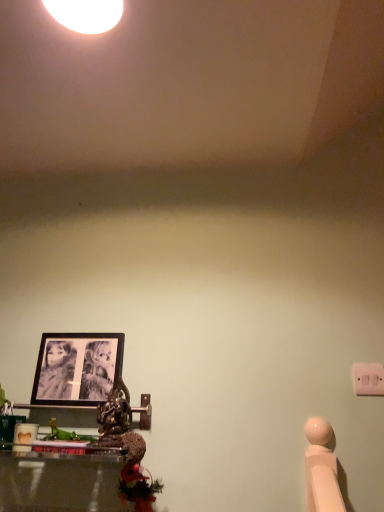
The height and width of the screenshot is (512, 384). Describe the element at coordinates (368, 379) in the screenshot. I see `white plastic light switch at right` at that location.

The image size is (384, 512). Find the location of `white plastic light switch at right`. white plastic light switch at right is located at coordinates (368, 379).

Measure the distance between point (366, 379) and camera.

Point (366, 379) is 1.22 meters away from camera.

Image resolution: width=384 pixels, height=512 pixels. Describe the element at coordinates (77, 368) in the screenshot. I see `black matte picture frame at left` at that location.

Identify the location of black matte picture frame at left. [77, 368].

What are the coordinates of `white plastic light switch at right` in the screenshot? It's located at (368, 379).

Is white plastic light switch at right to the left of black matte picture frame at left from the viewer's perspective?

No, white plastic light switch at right is not to the left of black matte picture frame at left.

Is the position of white plastic light switch at right more distant than that of black matte picture frame at left?

No, it is in front of black matte picture frame at left.

Does point (372, 394) come closer to viewer compared to point (58, 337)?

Yes, point (372, 394) is in front of point (58, 337).

From the image's perspective, between white plastic light switch at right and black matte picture frame at left, which one is located above?

black matte picture frame at left, from the image's perspective.

From a real-world perspective, which is physically above, white plastic light switch at right or black matte picture frame at left?

→ From a 3D spatial view, black matte picture frame at left is above.

Considering the relative sizes of white plastic light switch at right and black matte picture frame at left in the image provided, is white plastic light switch at right wider than black matte picture frame at left?

In fact, white plastic light switch at right might be narrower than black matte picture frame at left.

Considering the sizes of objects white plastic light switch at right and black matte picture frame at left in the image provided, who is taller, white plastic light switch at right or black matte picture frame at left?

With more height is black matte picture frame at left.

In terms of size, does white plastic light switch at right appear bigger or smaller than black matte picture frame at left?

Clearly, white plastic light switch at right is smaller in size than black matte picture frame at left.

Is white plastic light switch at right inside the boundaries of black matte picture frame at left, or outside?

The correct answer is: outside.

Based on the photo, can you see white plastic light switch at right touching black matte picture frame at left?

No, white plastic light switch at right is not next to black matte picture frame at left.

Is white plastic light switch at right positioned with its back to black matte picture frame at left?

white plastic light switch at right does not have its back to black matte picture frame at left.

What's the angular difference between white plastic light switch at right and black matte picture frame at left's facing directions?

1.13 degrees separate the facing orientations of white plastic light switch at right and black matte picture frame at left.

At what (x,y) coordinates should I click in order to perform the action: click on picture frame behind the white plastic light switch at right. Please return your answer as a coordinate pair (x, y). Image resolution: width=384 pixels, height=512 pixels. Looking at the image, I should click on (77, 368).

Between black matte picture frame at left and white plastic light switch at right, which one appears on the left side from the viewer's perspective?

black matte picture frame at left.

In the scene shown: Between black matte picture frame at left and white plastic light switch at right, which one is positioned behind?

black matte picture frame at left is further from the camera.

Is point (40, 368) behind point (352, 368)?

Yes.

From the image's perspective, is black matte picture frame at left below white plastic light switch at right?

No.

From a real-world perspective, who is located higher, black matte picture frame at left or white plastic light switch at right?

In real-world perspective, black matte picture frame at left is above.

Looking at this image, does black matte picture frame at left have a lesser width compared to white plastic light switch at right?

No.

Is black matte picture frame at left taller than white plastic light switch at right?

Indeed, black matte picture frame at left has a greater height compared to white plastic light switch at right.

Between black matte picture frame at left and white plastic light switch at right, which one has smaller size?

white plastic light switch at right is smaller.

Could white plastic light switch at right be considered to be inside black matte picture frame at left?

No, white plastic light switch at right is not surrounded by black matte picture frame at left.

Is black matte picture frame at left placed right next to white plastic light switch at right?

black matte picture frame at left is not next to white plastic light switch at right, and they're not touching.

Does black matte picture frame at left turn towards white plastic light switch at right?

No, black matte picture frame at left is not facing towards white plastic light switch at right.

How many degrees apart are the facing directions of black matte picture frame at left and white plastic light switch at right?

The angle between the facing direction of black matte picture frame at left and the facing direction of white plastic light switch at right is 1.13 degrees.

Image resolution: width=384 pixels, height=512 pixels. What are the coordinates of `light switch below the black matte picture frame at left (from the image's perspective)` in the screenshot? It's located at (368, 379).

You are a GUI agent. You are given a task and a screenshot of the screen. Output one action in this format:
    pyautogui.click(x=<x>, y=<y>)
    Task: Click on the light switch lying in front of the black matte picture frame at left
    
    Given the screenshot: What is the action you would take?
    pyautogui.click(x=368, y=379)

Find the location of a particular element. The width and height of the screenshot is (384, 512). picture frame above the white plastic light switch at right (from a real-world perspective) is located at coordinates (77, 368).